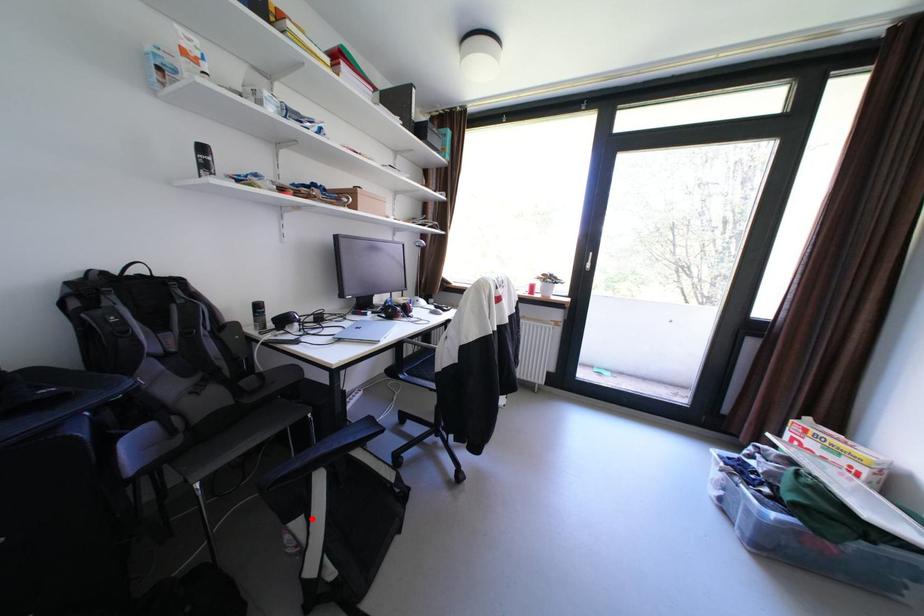
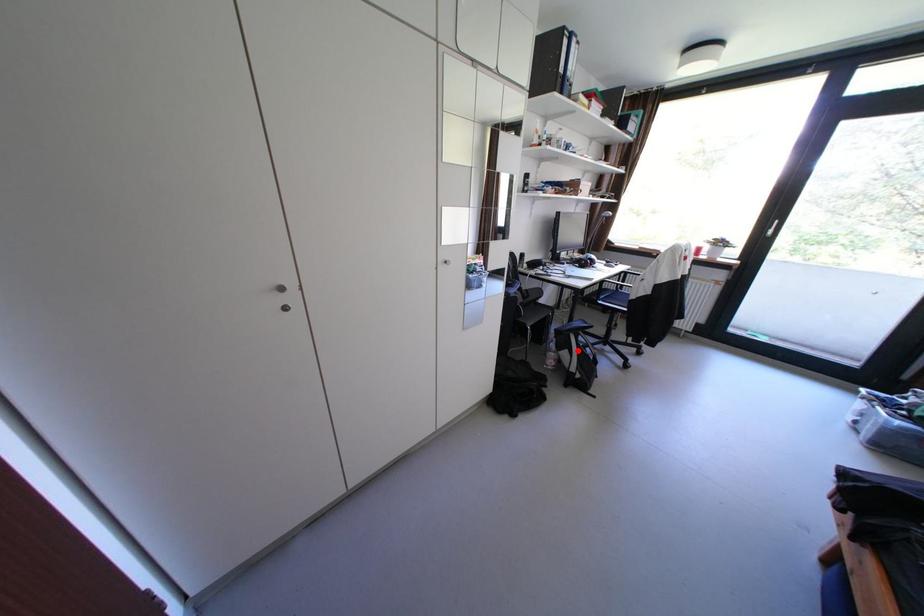
I am providing you with two images of the same scene from different viewpoints. A red point is marked on the first image and another point is marked on the second image. Are the points marked in image1 and image2 representing the same 3D position?

Yes